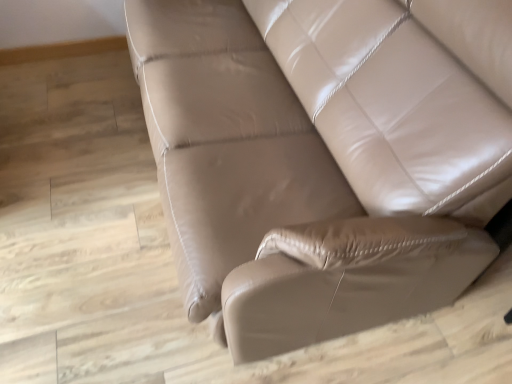
What do you see at coordinates (320, 160) in the screenshot? I see `matte leather couch at center` at bounding box center [320, 160].

At what (x,y) coordinates should I click in order to perform the action: click on matte leather couch at center. Please return your answer as a coordinate pair (x, y). Looking at the image, I should click on click(x=320, y=160).

From the picture: In order to face matte leather couch at center, should I rotate leftwards or rightwards?

Rotate your view right by about 2.255°.

Where is `matte leather couch at center`? The height and width of the screenshot is (384, 512). matte leather couch at center is located at coordinates (x=320, y=160).